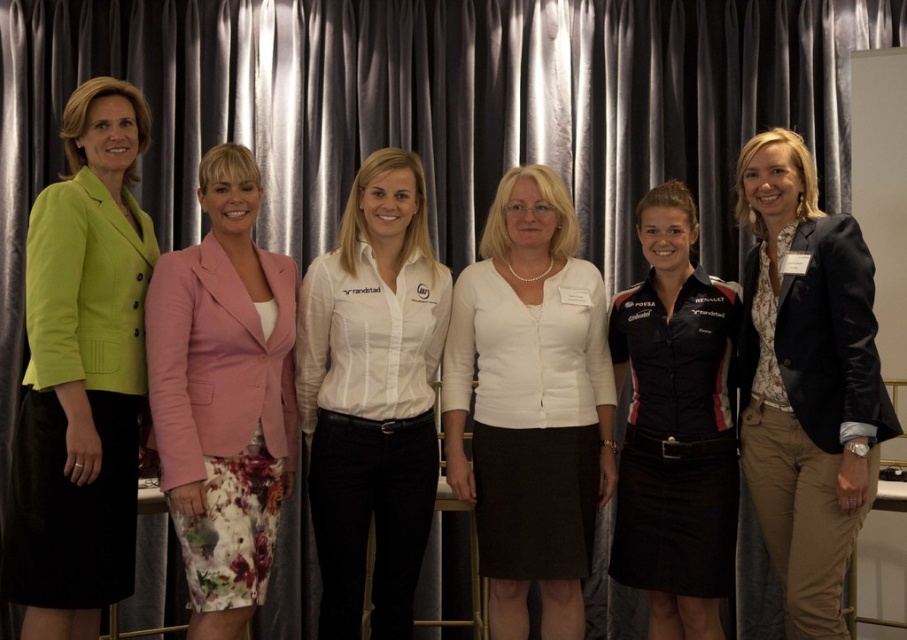
Is point (313, 445) in front of point (676, 308)?

That is True.

Is the position of white shirt at center less distant than that of black jersey at center?

Yes.

Image resolution: width=907 pixels, height=640 pixels. What do you see at coordinates (372, 396) in the screenshot?
I see `white shirt at center` at bounding box center [372, 396].

The image size is (907, 640). In order to click on white shirt at center in this screenshot , I will do `click(372, 396)`.

Is pink fabric skirt at center thinner than black jersey at center?

Yes.

Which is behind, point (188, 632) or point (649, 451)?

The point (649, 451) is more distant.

The width and height of the screenshot is (907, 640). What are the coordinates of `pink fabric skirt at center` in the screenshot? It's located at (223, 396).

Image resolution: width=907 pixels, height=640 pixels. I want to click on pink fabric skirt at center, so (223, 396).

Is point (47, 561) positioned in front of point (713, 282)?

Yes, point (47, 561) is closer to viewer.

Does lime green fabric jacket at left lie in front of black jersey at center?

→ Yes, lime green fabric jacket at left is closer to the viewer.

Is point (113, 476) positioned behind point (667, 625)?

That is False.

Where is `lime green fabric jacket at left`? This screenshot has width=907, height=640. lime green fabric jacket at left is located at coordinates (81, 374).